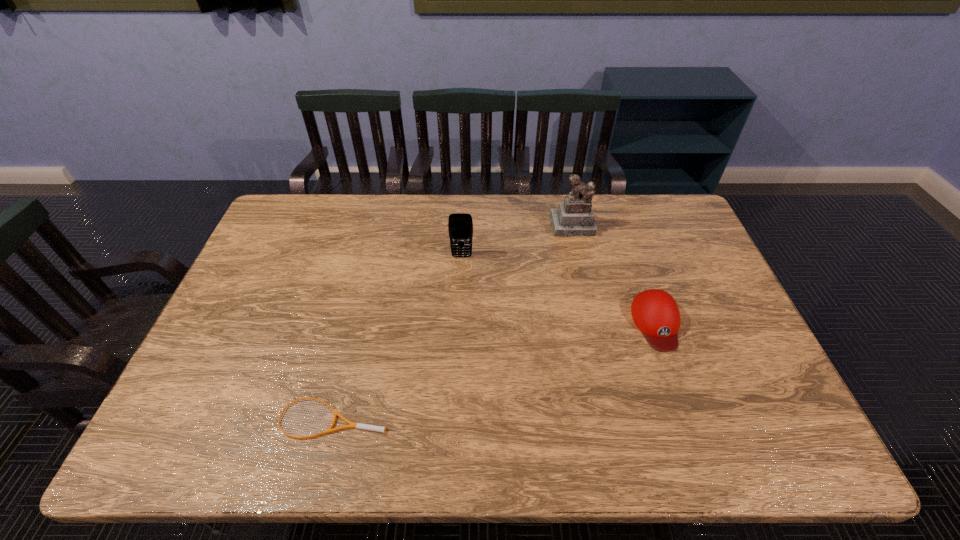
I want to click on object that ranks as the third closest to the second nearest object, so click(356, 425).